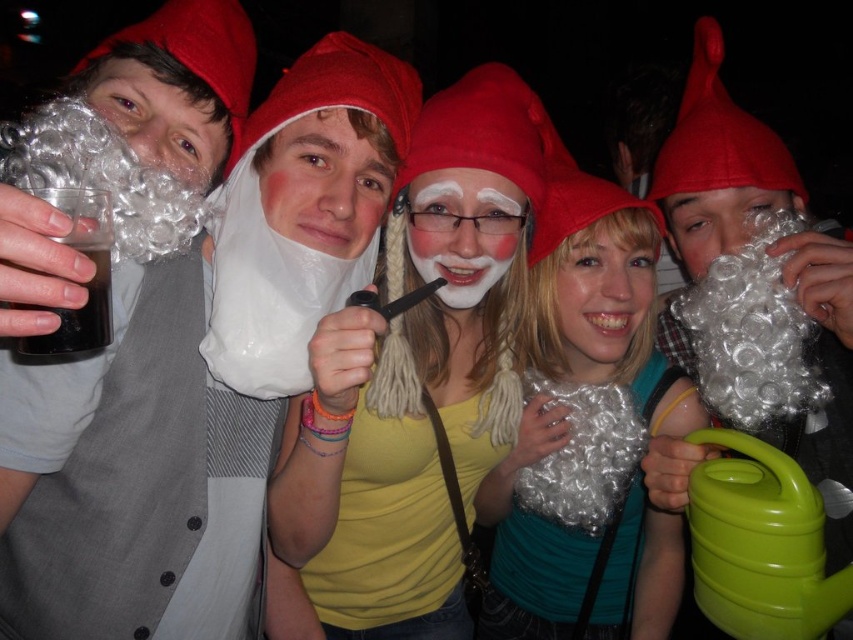
Question: Based on their relative distances, which object is farther from the fuzzy white wig at center?

Choices:
 (A) shiny silver wig at center
 (B) matte white wig at center
 (C) matte white beard at center

Answer: (A)

Question: Is white fluffy wig at center positioned in front of fuzzy white wig at center?

Choices:
 (A) yes
 (B) no

Answer: (A)

Question: Estimate the real-world distances between objects in this image. Which object is farther from the matte white beard at center?

Choices:
 (A) white fluffy wig at center
 (B) white matte face paint at center
 (C) fuzzy white wig at center
 (D) white curly wig at upper right

Answer: (A)

Question: Does white plastic bag at center appear on the left side of matte white beard at center?

Choices:
 (A) yes
 (B) no

Answer: (A)

Question: Which is farther from the matte white beard at center?

Choices:
 (A) white matte wig at center
 (B) matte white beard at left
 (C) fuzzy white wig at center

Answer: (A)

Question: Does matte white beard at left appear over matte white wig at center?

Choices:
 (A) yes
 (B) no

Answer: (B)